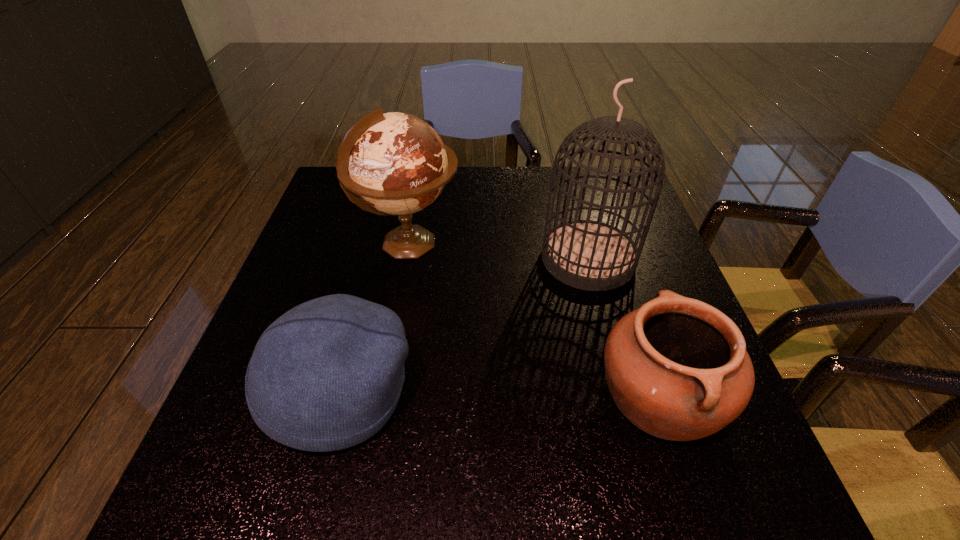
At what (x,y) coordinates should I click in order to perform the action: click on vacant position in the image that satisfies the following two spatial constraints: 1. on the front side of the skullcap; 2. on the left side of the pottery. Please return your answer as a coordinate pair (x, y). The image size is (960, 540). Looking at the image, I should click on point(340,395).

Locate an element on the screen. This screenshot has width=960, height=540. vacant space that satisfies the following two spatial constraints: 1. on the back side of the pottery; 2. on the front of the globe showing Asia is located at coordinates (610, 244).

The image size is (960, 540). What are the coordinates of `free point that satisfies the following two spatial constraints: 1. on the front of the globe showing Asia; 2. on the back side of the birdcage` in the screenshot? It's located at (407, 259).

At what (x,y) coordinates should I click in order to perform the action: click on free space that satisfies the following two spatial constraints: 1. on the front of the globe showing Asia; 2. on the back side of the tallest object. Please return your answer as a coordinate pair (x, y). Looking at the image, I should click on (407, 259).

Find the location of a particular element. This screenshot has height=540, width=960. vacant space that satisfies the following two spatial constraints: 1. on the front of the pottery showing Asia; 2. on the left side of the globe is located at coordinates (382, 395).